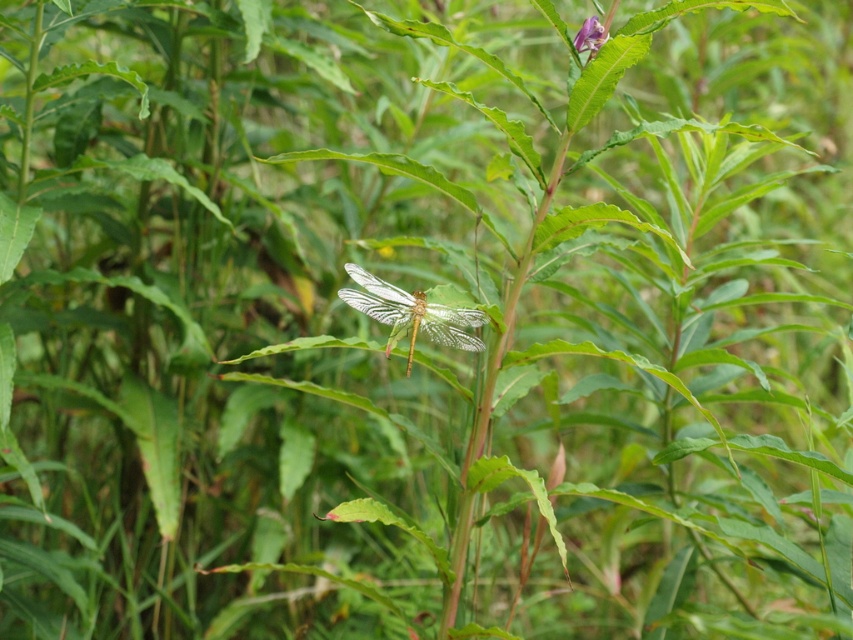
You are a gardener who needs to place a new decorative item in the garden. You have a 12 inch ruler. Can you determine if the distance between the translucent glass dragonfly at center and the purple matte flower at upper right is within the ruler length?

The distance between the translucent glass dragonfly at center and the purple matte flower at upper right is 16.88 inches, which is longer than the 12 inch ruler. Therefore, the distance exceeds the ruler length.

You are an artist trying to paint the scene. You need to know which object is taller between the translucent glass dragonfly at center and the purple matte flower at upper right to adjust your painting proportions. Which one is taller?

The translucent glass dragonfly at center is much taller than the purple matte flower at upper right according to the description.